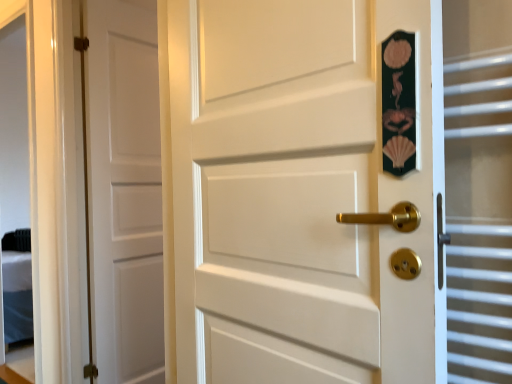
Question: Is white matte door at left, which is counted as the 1th door, starting from the left, to the right of white matte door at center, which ranks as the first door in front-to-back order, from the viewer's perspective?

Choices:
 (A) yes
 (B) no

Answer: (B)

Question: Can you confirm if white matte door at left, which is counted as the 1th door, starting from the left, is bigger than white matte door at center, the 1th door when ordered from right to left?

Choices:
 (A) yes
 (B) no

Answer: (B)

Question: Is white matte door at left, which is the 2th door from right to left, far from white matte door at center, the 1th door when ordered from right to left?

Choices:
 (A) no
 (B) yes

Answer: (B)

Question: Considering the relative sizes of white matte door at left, which is counted as the 1th door, starting from the left, and white matte door at center, which ranks as the first door in front-to-back order, in the image provided, is white matte door at left, which is counted as the 1th door, starting from the left, thinner than white matte door at center, which ranks as the first door in front-to-back order,?

Choices:
 (A) no
 (B) yes

Answer: (B)

Question: Does white matte door at left, which ranks as the first door in back-to-front order, have a smaller size compared to white matte door at center, which ranks as the first door in front-to-back order?

Choices:
 (A) no
 (B) yes

Answer: (B)

Question: Is white matte door at center, arranged as the second door when viewed from the back, located within white matte door at left, which is the 2th door from right to left?

Choices:
 (A) no
 (B) yes

Answer: (A)

Question: Does white matte door at left, which ranks as the first door in back-to-front order, have a lesser width compared to clear glass door at right?

Choices:
 (A) no
 (B) yes

Answer: (B)

Question: Is white matte door at left, which ranks as the second door in front-to-back order, looking in the opposite direction of clear glass door at right?

Choices:
 (A) yes
 (B) no

Answer: (B)

Question: Considering the relative sizes of white matte door at left, which ranks as the first door in back-to-front order, and clear glass door at right in the image provided, is white matte door at left, which ranks as the first door in back-to-front order, bigger than clear glass door at right?

Choices:
 (A) no
 (B) yes

Answer: (B)

Question: Is white matte door at left, which is counted as the 1th door, starting from the left, positioned behind clear glass door at right?

Choices:
 (A) yes
 (B) no

Answer: (A)

Question: Is white matte door at left, which ranks as the second door in front-to-back order, wider than clear glass door at right?

Choices:
 (A) yes
 (B) no

Answer: (B)

Question: Can you confirm if white matte door at left, which is the 2th door from right to left, is taller than clear glass door at right?

Choices:
 (A) yes
 (B) no

Answer: (A)

Question: Considering the relative positions of clear glass door at right and white matte door at center, the 2th door positioned from the left, in the image provided, is clear glass door at right in front of white matte door at center, the 2th door positioned from the left,?

Choices:
 (A) yes
 (B) no

Answer: (B)